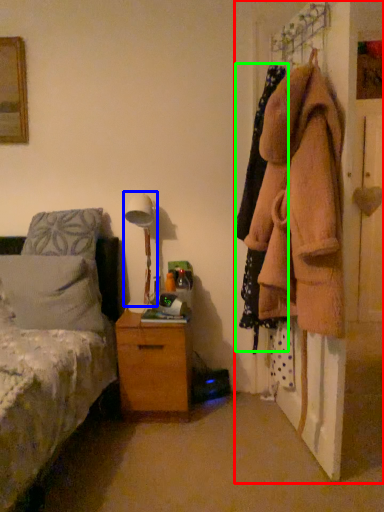
Question: Based on their relative distances, which object is nearer to closet (highlighted by a red box)? Choose from bedside lamp (highlighted by a blue box) and clothing (highlighted by a green box).

Choices:
 (A) bedside lamp
 (B) clothing

Answer: (B)